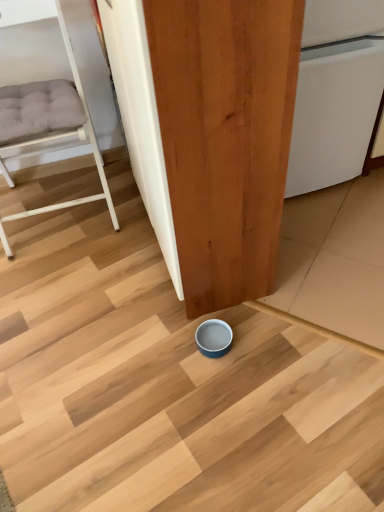
Question: Is white matte bunk bed at left to the right of white glossy dishwasher at center from the viewer's perspective?

Choices:
 (A) no
 (B) yes

Answer: (A)

Question: Are white matte bunk bed at left and white glossy dishwasher at center making contact?

Choices:
 (A) no
 (B) yes

Answer: (A)

Question: From the image's perspective, is white matte bunk bed at left under white glossy dishwasher at center?

Choices:
 (A) yes
 (B) no

Answer: (A)

Question: Is white glossy dishwasher at center a part of white matte bunk bed at left?

Choices:
 (A) no
 (B) yes

Answer: (A)

Question: Is white matte bunk bed at left not inside white glossy dishwasher at center?

Choices:
 (A) yes
 (B) no

Answer: (A)

Question: Considering their positions, is white matte bunk bed at left located in front of or behind matte wood door at center?

Choices:
 (A) behind
 (B) front

Answer: (A)

Question: Choose the correct answer: Is white matte bunk bed at left inside matte wood door at center or outside it?

Choices:
 (A) inside
 (B) outside

Answer: (B)

Question: Based on their positions, is white matte bunk bed at left located to the left or right of matte wood door at center?

Choices:
 (A) right
 (B) left

Answer: (B)

Question: Is white matte bunk bed at left wider or thinner than matte wood door at center?

Choices:
 (A) thin
 (B) wide

Answer: (B)

Question: From a real-world perspective, is white glossy dishwasher at center positioned above or below matte wood door at center?

Choices:
 (A) below
 (B) above

Answer: (A)

Question: Visually, is white glossy dishwasher at center positioned to the left or to the right of matte wood door at center?

Choices:
 (A) left
 (B) right

Answer: (B)

Question: In the image, is white glossy dishwasher at center positioned in front of or behind matte wood door at center?

Choices:
 (A) behind
 (B) front

Answer: (A)

Question: Considering the positions of white glossy dishwasher at center and matte wood door at center in the image, is white glossy dishwasher at center bigger or smaller than matte wood door at center?

Choices:
 (A) small
 (B) big

Answer: (A)

Question: Based on their sizes in the image, would you say white matte bunk bed at left is bigger or smaller than white glossy dishwasher at center?

Choices:
 (A) big
 (B) small

Answer: (A)

Question: Is white matte bunk bed at left in front of or behind white glossy dishwasher at center in the image?

Choices:
 (A) front
 (B) behind

Answer: (A)